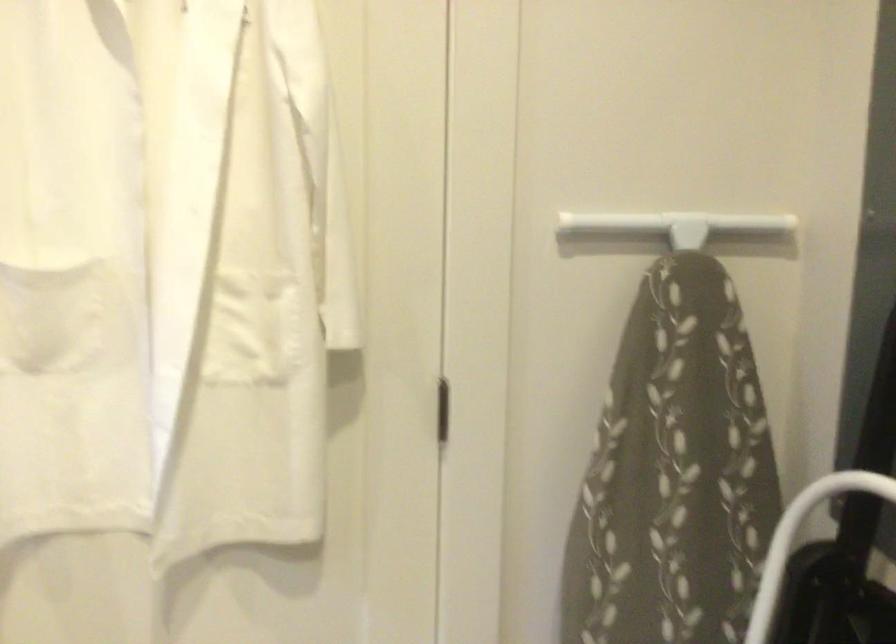
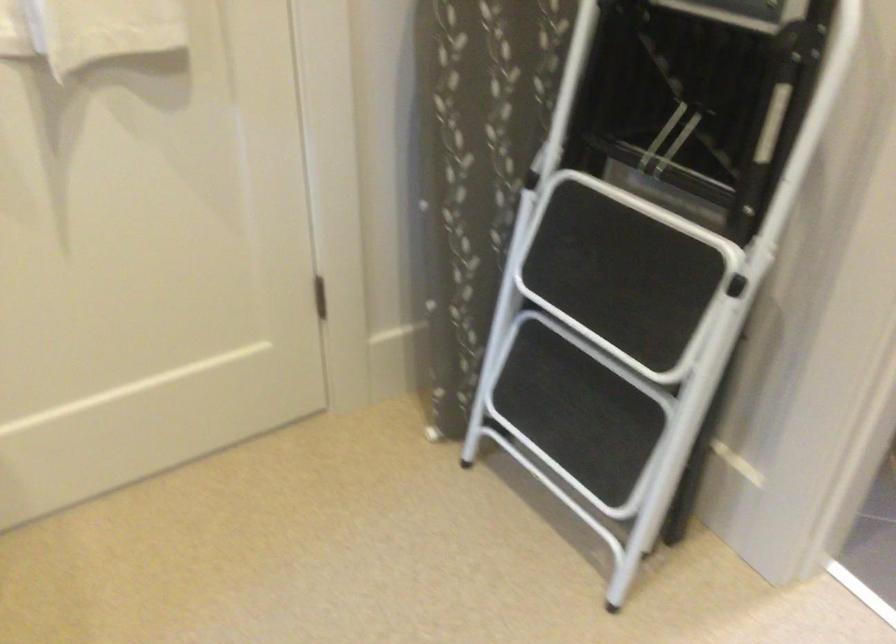
Where in the second image is the point corresponding to the point at 217,526 from the first image?

(89, 30)